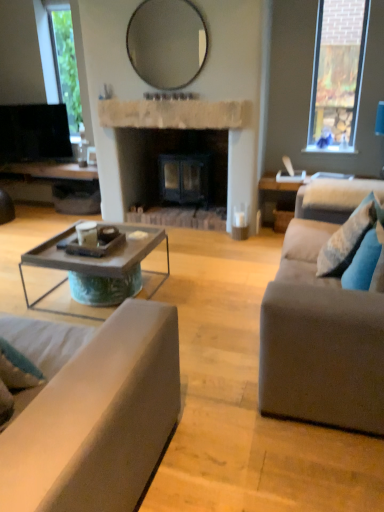
Question: Is rustic wood coffee table at center directly adjacent to matte gray couch at lower left, which appears as the second studio couch when viewed from the right?

Choices:
 (A) no
 (B) yes

Answer: (A)

Question: Can you confirm if rustic wood coffee table at center is thinner than matte gray couch at lower left, the first studio couch when ordered from left to right?

Choices:
 (A) no
 (B) yes

Answer: (B)

Question: Can you confirm if rustic wood coffee table at center is positioned to the left of matte gray couch at lower left, the first studio couch when ordered from left to right?

Choices:
 (A) yes
 (B) no

Answer: (B)

Question: Is rustic wood coffee table at center bigger than matte gray couch at lower left, the first studio couch when ordered from left to right?

Choices:
 (A) no
 (B) yes

Answer: (A)

Question: From the image's perspective, is rustic wood coffee table at center below matte gray couch at lower left, the first studio couch when ordered from left to right?

Choices:
 (A) no
 (B) yes

Answer: (A)

Question: Is rustic wood coffee table at center to the right of matte gray couch at lower left, which appears as the second studio couch when viewed from the right, from the viewer's perspective?

Choices:
 (A) yes
 (B) no

Answer: (A)

Question: Is rustic wood coffee table at center shorter than black glossy television at upper left?

Choices:
 (A) no
 (B) yes

Answer: (B)

Question: Is the depth of rustic wood coffee table at center greater than that of black glossy television at upper left?

Choices:
 (A) no
 (B) yes

Answer: (A)

Question: From a real-world perspective, is rustic wood coffee table at center under black glossy television at upper left?

Choices:
 (A) yes
 (B) no

Answer: (A)

Question: Can you confirm if rustic wood coffee table at center is smaller than black glossy television at upper left?

Choices:
 (A) no
 (B) yes

Answer: (A)

Question: Is rustic wood coffee table at center to the left of black glossy television at upper left from the viewer's perspective?

Choices:
 (A) no
 (B) yes

Answer: (A)

Question: Is rustic wood coffee table at center touching black glossy television at upper left?

Choices:
 (A) yes
 (B) no

Answer: (B)

Question: Does matte glass mirror at upper center have a larger size compared to blue fabric pillow at right, which is counted as the 1th pillow, starting from the front?

Choices:
 (A) yes
 (B) no

Answer: (A)